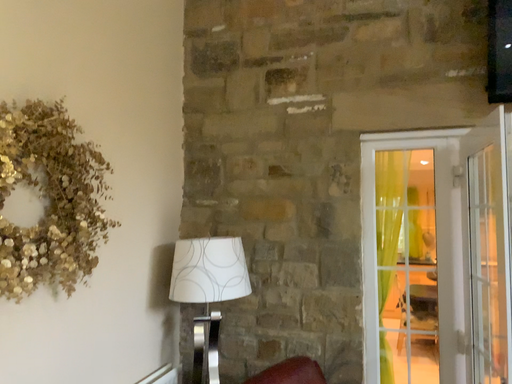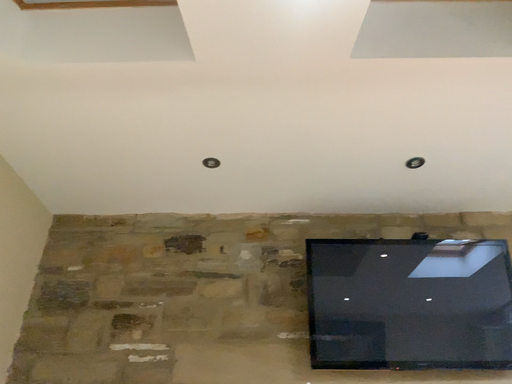
Question: How did the camera likely rotate when shooting the video?

Choices:
 (A) rotated right
 (B) rotated left

Answer: (A)